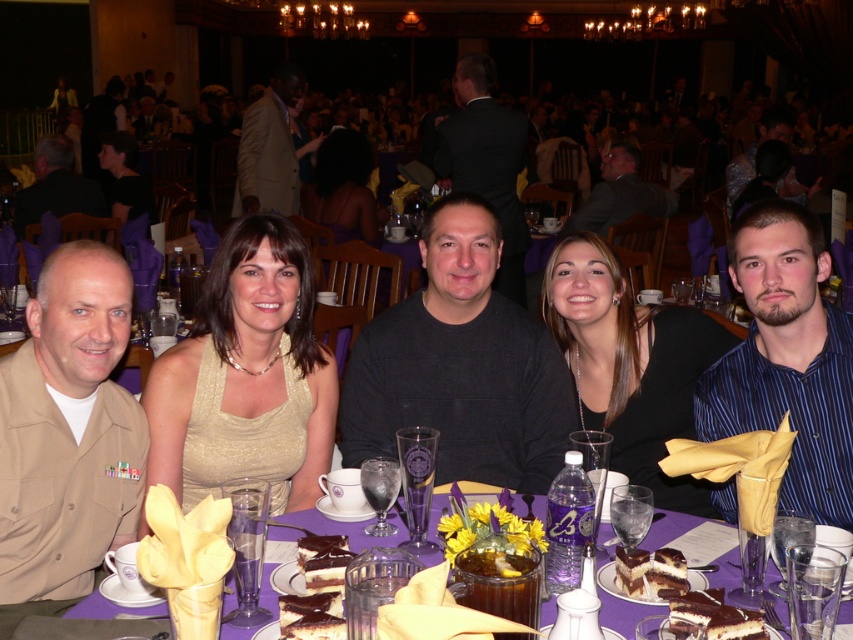
Question: Which object is positioned farthest from the gold sequined dress at center?

Choices:
 (A) khaki uniform at left
 (B) light beige suit at center
 (C) black matte suit at upper center

Answer: (B)

Question: Is purple fabric table at center smaller than matte gold dress at center?

Choices:
 (A) yes
 (B) no

Answer: (A)

Question: Among these objects, which one is nearest to the camera?

Choices:
 (A) light beige suit at center
 (B) dark gray suit at center
 (C) shiny blue shirt at center
 (D) black silk dress at center

Answer: (D)

Question: Which of the following is the farthest from the observer?

Choices:
 (A) purple fabric table at center
 (B) matte gold dress at center
 (C) chocolate frosted cake at center
 (D) dark gray sweater at center

Answer: (B)

Question: Is dark gray sweater at center further to camera compared to black matte suit at upper center?

Choices:
 (A) no
 (B) yes

Answer: (A)

Question: From the image, what is the correct spatial relationship of light beige suit at center in relation to shiny blue shirt at center?

Choices:
 (A) left
 (B) right

Answer: (A)